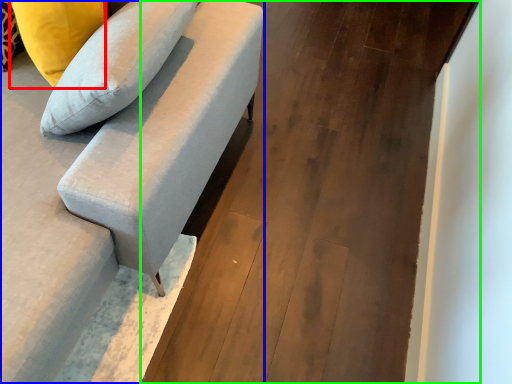
Question: Which object is the closest to the pillow (highlighted by a red box)? Choose among these: studio couch (highlighted by a blue box) or concrete (highlighted by a green box).

Choices:
 (A) studio couch
 (B) concrete

Answer: (A)